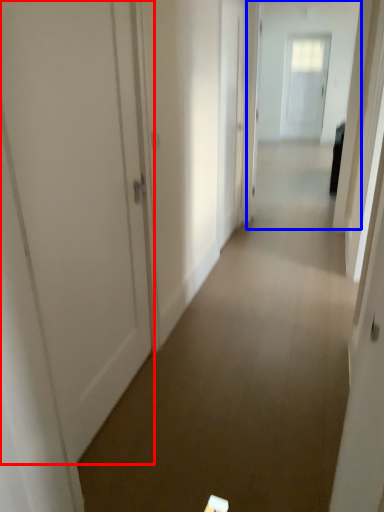
Question: Which object is closer to the camera taking this photo, door (highlighted by a red box) or passage (highlighted by a blue box)?

Choices:
 (A) door
 (B) passage

Answer: (A)